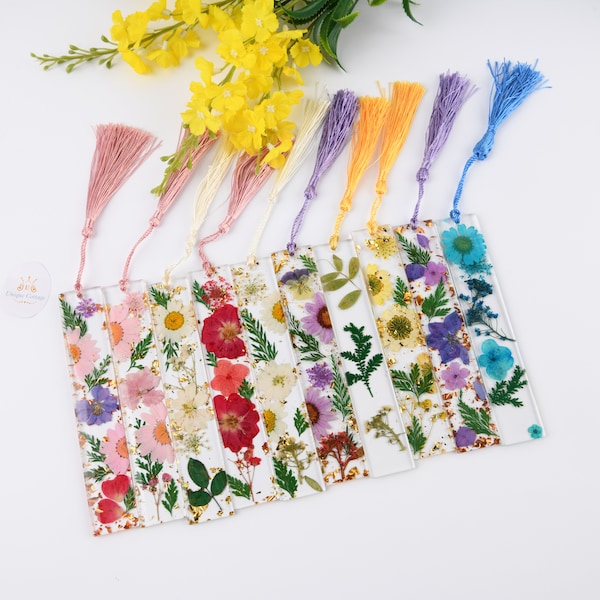
The height and width of the screenshot is (600, 600). Identify the location of white rectangles with floral patterns on them. (90, 309), (108, 511), (209, 502), (510, 429), (461, 241), (367, 258).